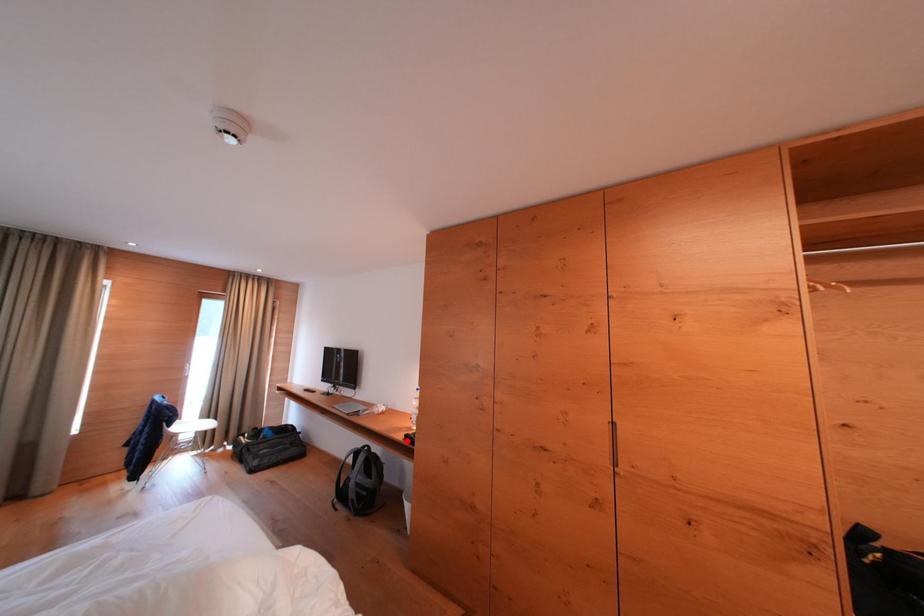
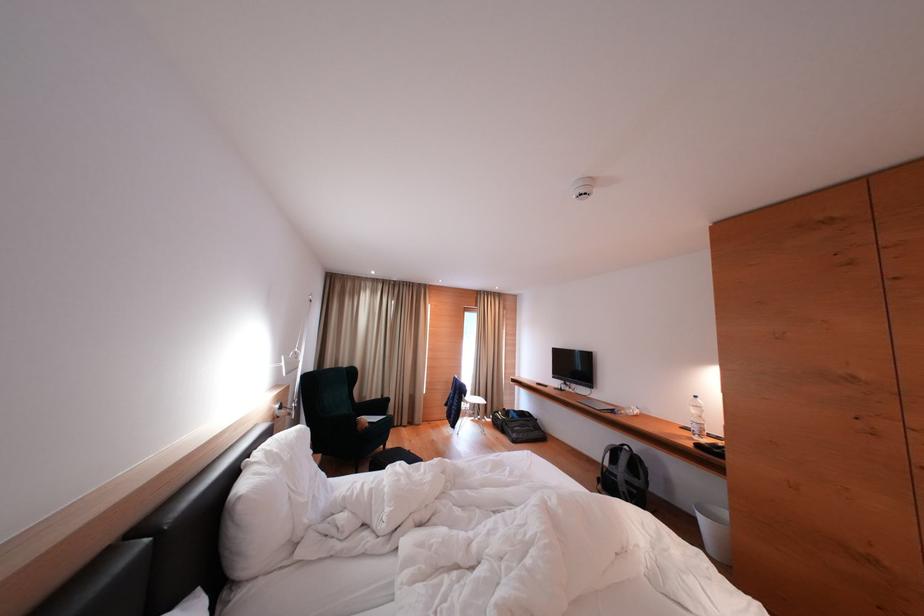
Where in the second image is the point corresponding to the highlighted location from the first image?

(696, 448)